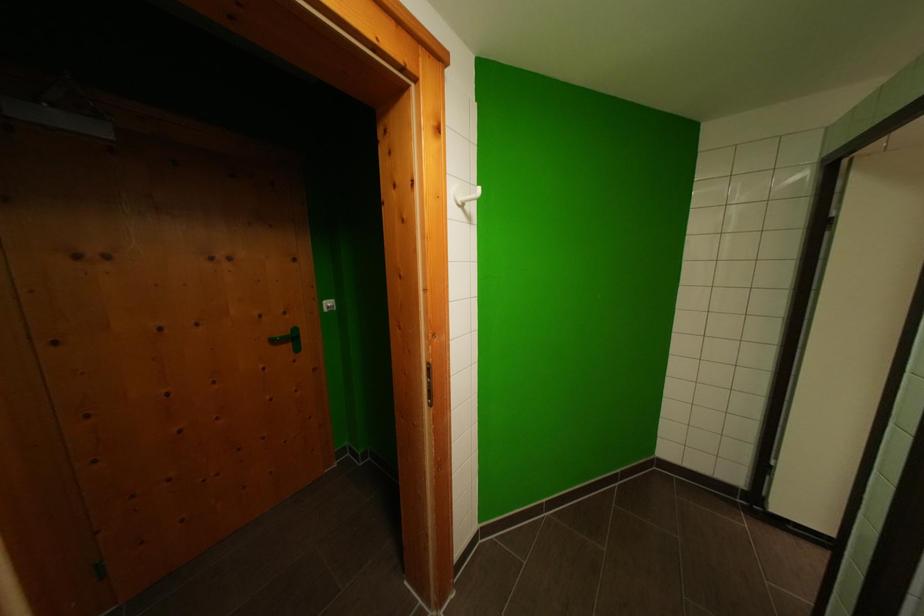
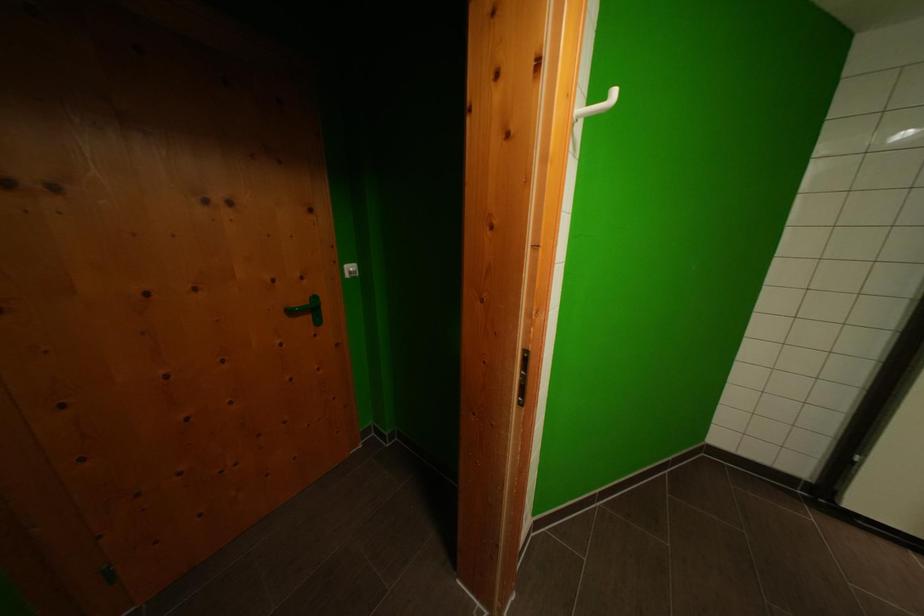
The point at [281,345] is marked in the first image. Where is the corresponding point in the second image?

(297, 315)